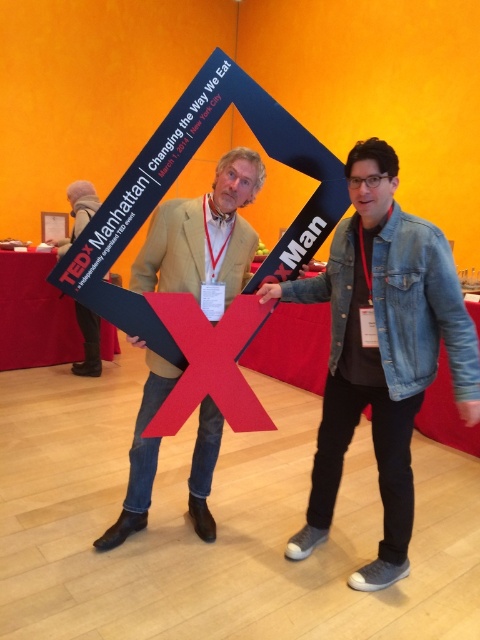
You are a photographer preparing to take a photo of the two people holding the frame. You notice the denim jacket at lower right and the light brown leather jacket at center. Which jacket is closer to the camera?

The denim jacket at lower right is positioned under the light brown leather jacket at center, meaning the light brown leather jacket at center is closer to the camera.